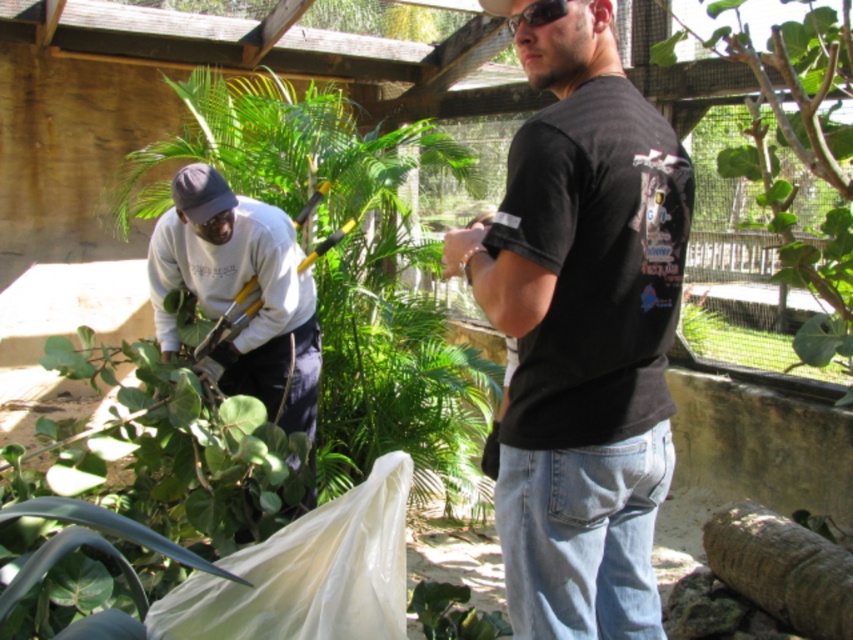
Is black cotton t-shirt at center to the right of gray cotton shirt at left from the viewer's perspective?

Yes, black cotton t-shirt at center is to the right of gray cotton shirt at left.

Does black cotton t-shirt at center have a greater width compared to gray cotton shirt at left?

Incorrect, black cotton t-shirt at center's width does not surpass gray cotton shirt at left's.

What do you see at coordinates (583, 333) in the screenshot? I see `black cotton t-shirt at center` at bounding box center [583, 333].

Where is `black cotton t-shirt at center`? black cotton t-shirt at center is located at coordinates (583, 333).

Where is `gray cotton shirt at left`? gray cotton shirt at left is located at coordinates (238, 289).

Can you confirm if gray cotton shirt at left is smaller than black plastic sunglasses at upper center?

No, gray cotton shirt at left is not smaller than black plastic sunglasses at upper center.

Between point (227, 200) and point (553, 8), which one is positioned behind?

Positioned behind is point (227, 200).

At what (x,y) coordinates should I click in order to perform the action: click on gray cotton shirt at left. Please return your answer as a coordinate pair (x, y). This screenshot has width=853, height=640. Looking at the image, I should click on (238, 289).

Is black plastic sunglasses at upper center to the left of black fabric baseball hat at upper center from the viewer's perspective?

No, black plastic sunglasses at upper center is not to the left of black fabric baseball hat at upper center.

From the picture: Between black plastic sunglasses at upper center and black fabric baseball hat at upper center, which one has more height?

black fabric baseball hat at upper center is taller.

Who is more forward, (538, 1) or (477, 0)?

Point (538, 1)

Image resolution: width=853 pixels, height=640 pixels. I want to click on black plastic sunglasses at upper center, so click(538, 13).